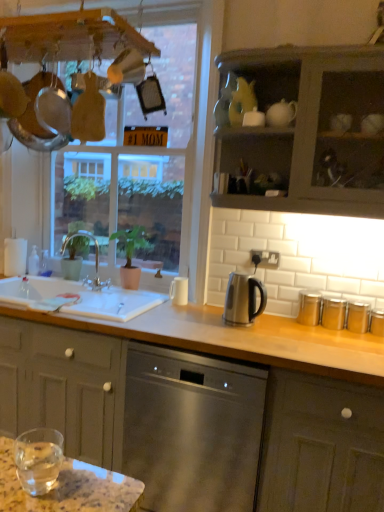
In order to click on unoccupied region to the right of white matte cup at center in this screenshot , I will do `click(204, 304)`.